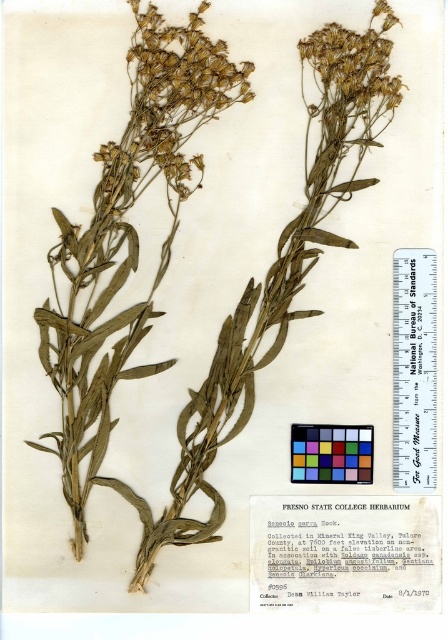
Which is more to the left, dry grass at upper left or metallic silver ruler at center-right?

dry grass at upper left is more to the left.

Who is taller, dry grass at upper left or metallic silver ruler at center-right?

metallic silver ruler at center-right is taller.

Measure the distance between dry grass at upper left and camera.

The distance of dry grass at upper left from camera is 1.35 meters.

At what (x,y) coordinates should I click in order to perform the action: click on dry grass at upper left. Please return your answer as a coordinate pair (x, y). The width and height of the screenshot is (448, 640). Looking at the image, I should click on (167, 106).

Is dry grass at upper left taller than dry grass at upper center?

Indeed, dry grass at upper left has a greater height compared to dry grass at upper center.

In the scene shown: Can you confirm if dry grass at upper left is bigger than dry grass at upper center?

Yes.

Between point (151, 17) and point (318, 44), which one is positioned in front?

Point (151, 17) is more forward.

Locate an element on the screen. The width and height of the screenshot is (448, 640). dry grass at upper left is located at coordinates (167, 106).

What do you see at coordinates (414, 371) in the screenshot?
I see `metallic silver ruler at center-right` at bounding box center [414, 371].

Can you confirm if metallic silver ruler at center-right is positioned below dry grass at upper center?

Indeed, metallic silver ruler at center-right is positioned under dry grass at upper center.

Between point (417, 253) and point (348, 97), which one is positioned in front?

Point (348, 97) is in front.

Identify the location of metallic silver ruler at center-right. coord(414,371).